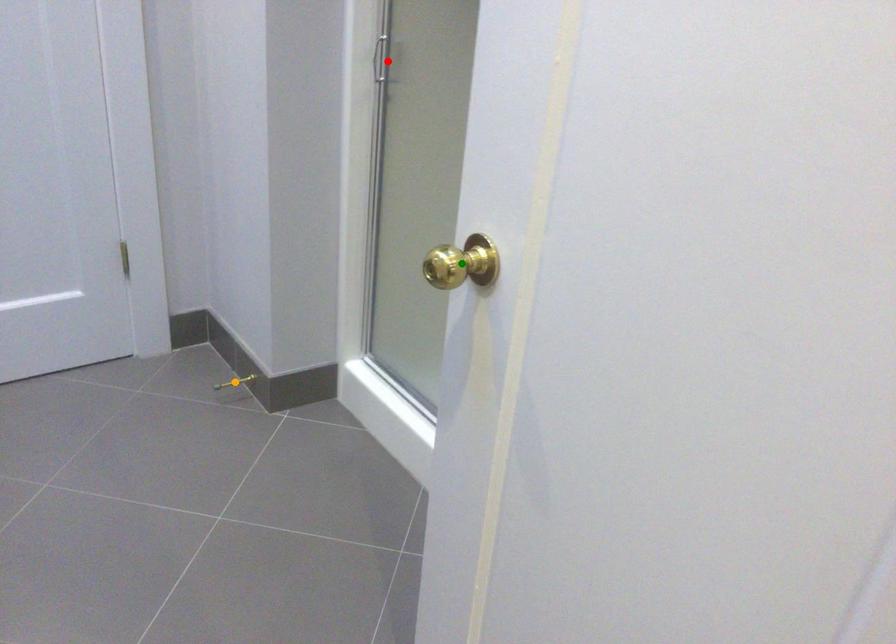
Order these from nearest to farthest:
red point
green point
orange point

green point
red point
orange point